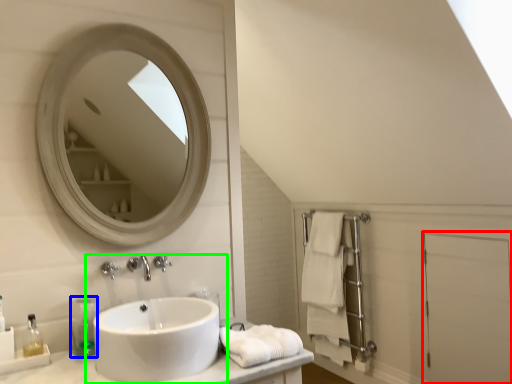
Question: Based on their relative distances, which object is farther from screen door (highlighted by a red box)? Choose from soap dispenser (highlighted by a blue box) and sink (highlighted by a green box).

Choices:
 (A) soap dispenser
 (B) sink

Answer: (A)